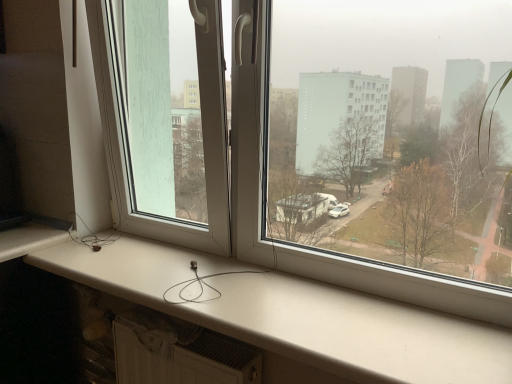
This screenshot has height=384, width=512. Identify the location of free space behind transparent plastic window screen at left. tap(142, 241).